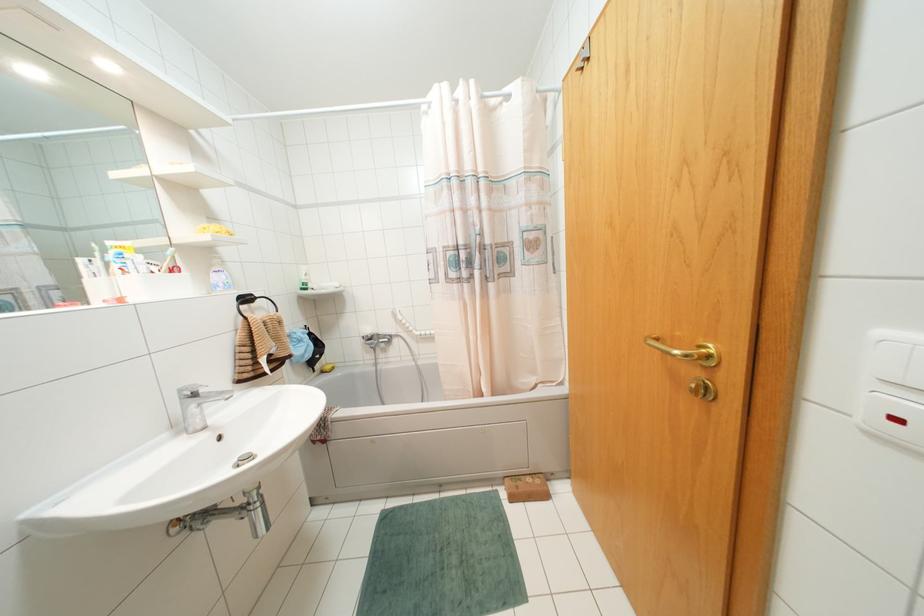
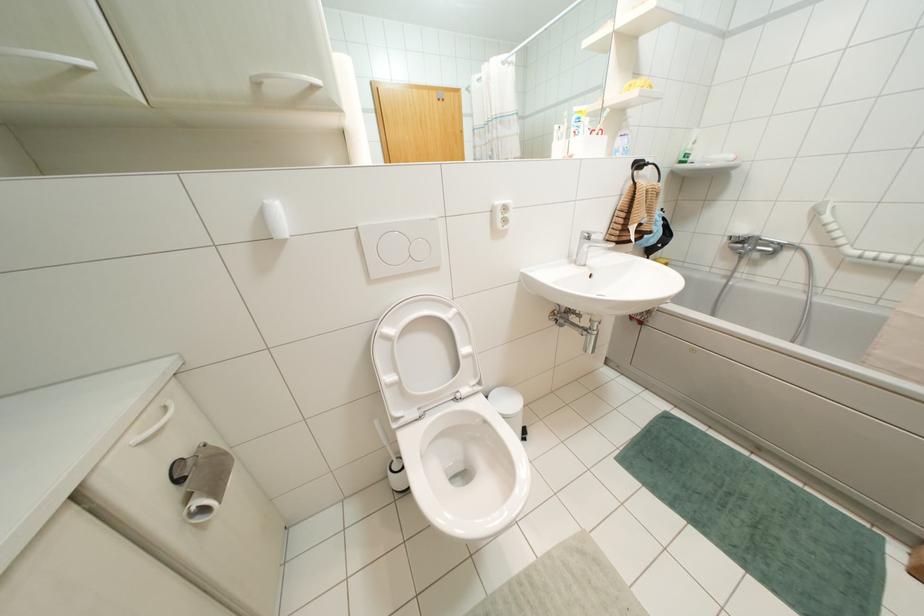
First-person continuous shooting, in which direction is the camera rotating?

The camera's rotation is toward left-down.